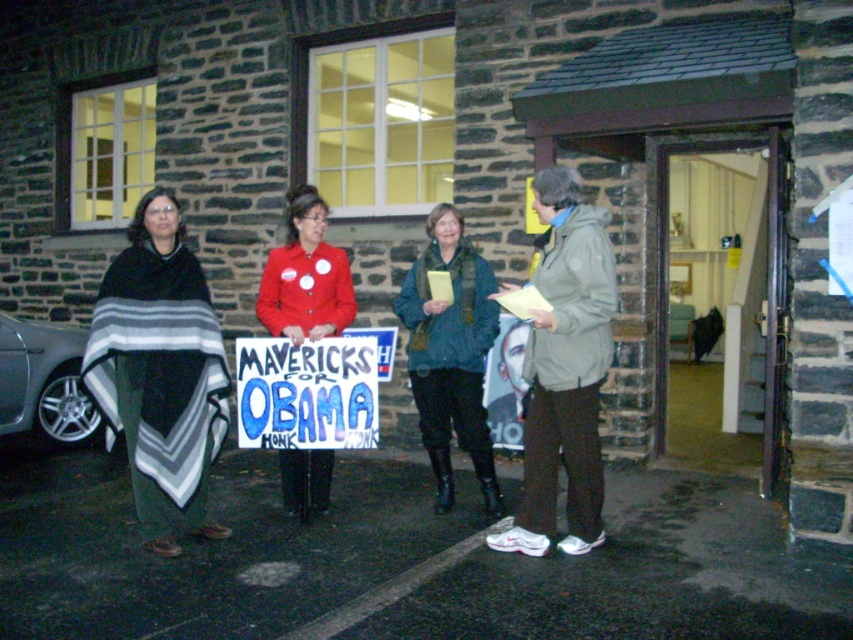
You are standing in front of the stone building and want to determine which of the two points, point (312, 438) or point (268, 266), is closer to you. Based on the scene description, which point is nearer?

Point (312, 438) is closer to the viewer than point (268, 266).

You are trying to take a photo of the blue painted cardboard sign at center and the red matte jacket at center. Since the camera can only focus on one object at a time, which object should you focus on first to ensure it is fully visible in the frame?

The blue painted cardboard sign at center might be wider than red matte jacket at center, so you should focus on the blue painted cardboard sign at center first to ensure it fits entirely within the camera frame.